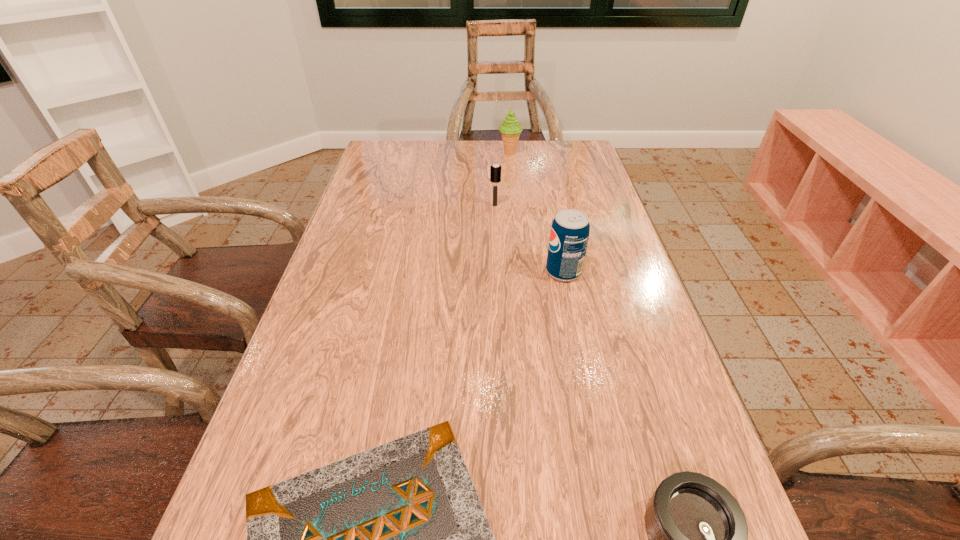
The width and height of the screenshot is (960, 540). I want to click on the farthest object, so click(510, 129).

Locate an element on the screen. icecream is located at coordinates (510, 129).

Identify the location of the third farthest object. (569, 234).

At what (x,y) coordinates should I click in order to perform the action: click on the third tallest object. Please return your answer as a coordinate pair (x, y). The image size is (960, 540). Looking at the image, I should click on (495, 169).

Image resolution: width=960 pixels, height=540 pixels. Find the location of `hairbrush`. hairbrush is located at coordinates (495, 169).

The height and width of the screenshot is (540, 960). What are the coordinates of `vacant region located 0.050m on the left of the farthest object` in the screenshot? It's located at (484, 153).

Image resolution: width=960 pixels, height=540 pixels. What are the coordinates of `free region located 0.250m on the left of the third nearest object` in the screenshot? It's located at (442, 272).

Where is `vacant space located 0.120m on the back of the third tallest object`? The image size is (960, 540). vacant space located 0.120m on the back of the third tallest object is located at coordinates (493, 181).

Find the location of a particular element. object located in the far edge section of the desktop is located at coordinates (510, 129).

Locate an element on the screen. object that is positioned at the right edge is located at coordinates (569, 234).